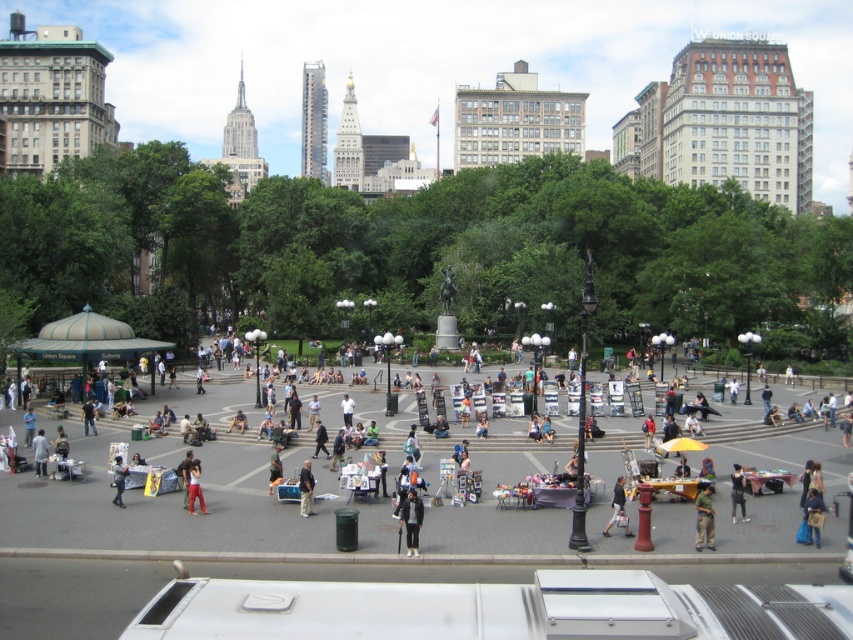
Question: Which object is closer to the camera taking this photo?

Choices:
 (A) dark blue jeans at center
 (B) dark gray pants at center
 (C) dark gray jacket at center

Answer: (A)

Question: Does dark blue jeans at center appear under black matte jacket at center?

Choices:
 (A) yes
 (B) no

Answer: (B)

Question: Can you confirm if green matte shirt at lower right is positioned below dark gray jacket at lower right?

Choices:
 (A) yes
 (B) no

Answer: (B)

Question: Which object is the closest to the dark gray jacket at lower right?

Choices:
 (A) dark gray pants at center
 (B) dark gray jacket at center
 (C) dark blue jeans at lower left

Answer: (B)

Question: Can you confirm if dark gray jacket at center is positioned above dark gray pants at center?

Choices:
 (A) yes
 (B) no

Answer: (B)

Question: Which object is the closest to the dark blue jeans at center?

Choices:
 (A) dark gray jacket at center
 (B) red cotton pants at lower left
 (C) dark gray pants at center

Answer: (A)